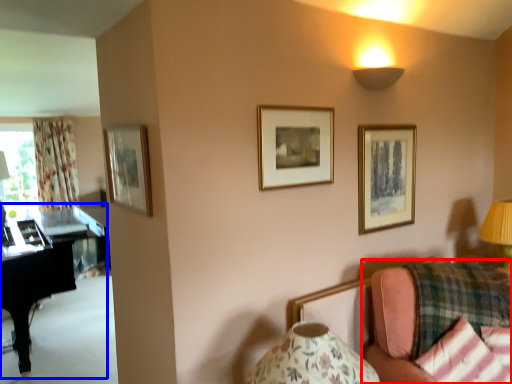
Question: Among these objects, which one is farthest to the camera, studio couch (highlighted by a red box) or piano (highlighted by a blue box)?

Choices:
 (A) studio couch
 (B) piano

Answer: (B)